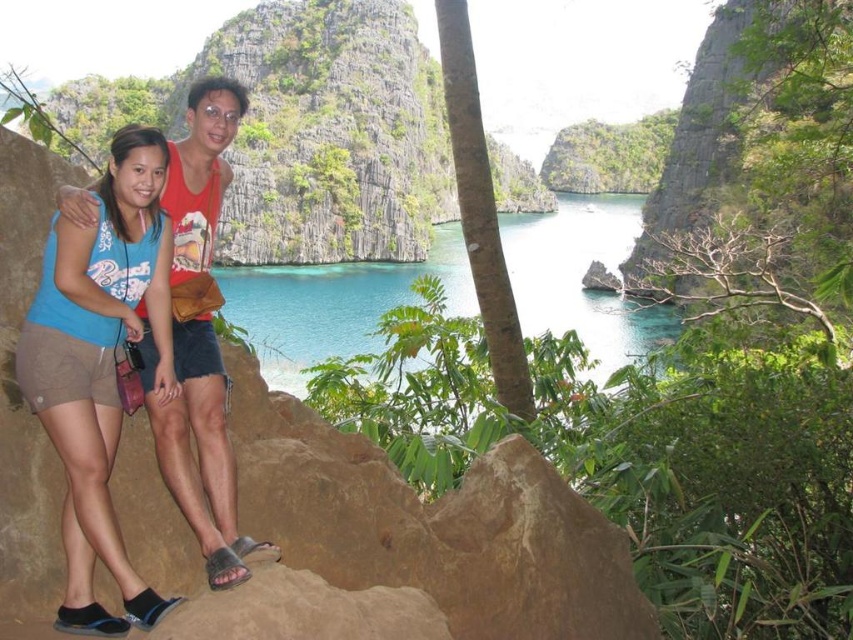
You are a photographer trying to capture the blue fabric shorts at lower left in the scene. Based on their position coordinates, where should you aim your camera?

The blue fabric shorts at lower left are located at coordinates point (100, 364), so aim your camera towards that position to capture them.

You are a photographer planning to capture the scene from the same vantage point. Given the blue fabric shorts at lower left and the clear blue water at center, which object would require a wider angle lens to fully capture in the frame?

The clear blue water at center requires a wider angle lens because it has a greater width than the blue fabric shorts at lower left.